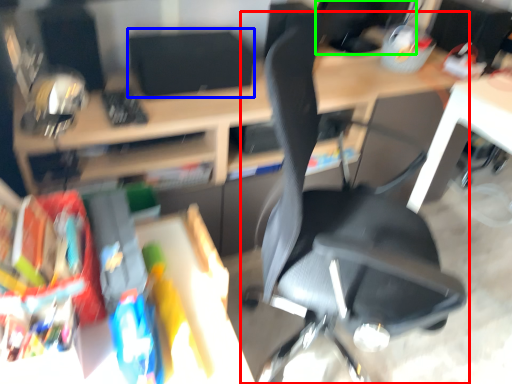
Question: Estimate the real-world distances between objects in this image. Which object is farther from chair (highlighted by a red box), computer monitor (highlighted by a blue box) or computer monitor (highlighted by a green box)?

Choices:
 (A) computer monitor
 (B) computer monitor

Answer: (B)